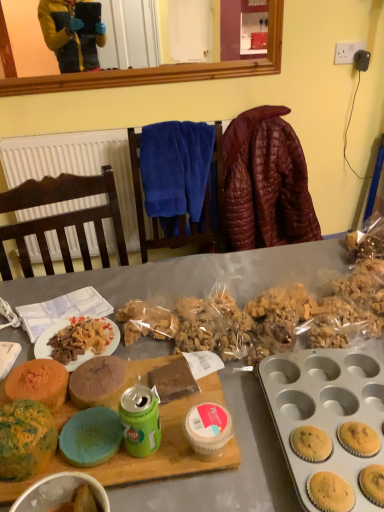
What do you see at coordinates (196, 275) in the screenshot?
I see `matte wooden desk at center` at bounding box center [196, 275].

Measure the distance between matte wooden desk at center and camera.

26.48 inches.

At what (x,y) coordinates should I click in order to perform the action: click on white textured radiator at upper left. Please return your answer as a coordinate pair (x, y). This screenshot has width=384, height=512. Looking at the image, I should click on (76, 165).

Measure the distance between white textured radiator at upper left and camera.

The depth of white textured radiator at upper left is 5.26 feet.

What do you see at coordinates (140, 420) in the screenshot? I see `green metallic can at center` at bounding box center [140, 420].

What are the coordinates of `matte wooden desk at center` in the screenshot? It's located at (196, 275).

Locate an element on the screen. desk below the blue soft towel at center (from the image's perspective) is located at coordinates (196, 275).

Based on the photo, considering the sizes of matte wooden desk at center and blue soft towel at center in the image, is matte wooden desk at center taller or shorter than blue soft towel at center?

In the image, matte wooden desk at center appears to be taller than blue soft towel at center.

Considering the relative sizes of blue soft towel at center and multicolored sponge cake at center left, which is counted as the second snack, starting from the front, in the image provided, is blue soft towel at center smaller than multicolored sponge cake at center left, which is counted as the second snack, starting from the front,?

No, blue soft towel at center is not smaller than multicolored sponge cake at center left, which is counted as the second snack, starting from the front.

Considering the relative positions of blue soft towel at center and multicolored sponge cake at center left, which is counted as the second snack, starting from the front, in the image provided, is blue soft towel at center to the right of multicolored sponge cake at center left, which is counted as the second snack, starting from the front, from the viewer's perspective?

Yes, blue soft towel at center is to the right of multicolored sponge cake at center left, which is counted as the second snack, starting from the front.

Are blue soft towel at center and multicolored sponge cake at center left, the 1th snack when ordered from back to front, located far from each other?

blue soft towel at center is positioned a significant distance from multicolored sponge cake at center left, the 1th snack when ordered from back to front.

Is blue soft towel at center spatially inside multicolored sponge cake at center left, which is counted as the second snack, starting from the front, or outside of it?

blue soft towel at center is not inside multicolored sponge cake at center left, which is counted as the second snack, starting from the front, it's outside.

From a real-world perspective, which object rests below the other?

white matte plate at center, from a real-world perspective.

Based on the photo, relative to white matte plate at center, is blue soft towel at center in front or behind?

Clearly, blue soft towel at center is behind white matte plate at center.

Can you tell me how much blue soft towel at center and white matte plate at center differ in facing direction?

The angular difference between blue soft towel at center and white matte plate at center is 4.8 degrees.

Is blue soft towel at center to the left or to the right of white matte plate at center in the image?

Clearly, blue soft towel at center is on the right of white matte plate at center in the image.

Is multicolored sponge cake at center left, which is counted as the second snack, starting from the front, next to speckled green cake at center left, which ranks as the first snack in front-to-back order, and touching it?

Yes, multicolored sponge cake at center left, which is counted as the second snack, starting from the front, is in contact with speckled green cake at center left, which ranks as the first snack in front-to-back order.

Is multicolored sponge cake at center left, which is counted as the second snack, starting from the front, spatially inside speckled green cake at center left, arranged as the second snack when viewed from the back, or outside of it?

multicolored sponge cake at center left, which is counted as the second snack, starting from the front, is outside speckled green cake at center left, arranged as the second snack when viewed from the back.

How many degrees apart are the facing directions of multicolored sponge cake at center left, the 1th snack when ordered from back to front, and speckled green cake at center left, which ranks as the first snack in front-to-back order?

The facing directions of multicolored sponge cake at center left, the 1th snack when ordered from back to front, and speckled green cake at center left, which ranks as the first snack in front-to-back order, are 0 degrees apart.

From a real-world perspective, relative to speckled green cake at center left, arranged as the second snack when viewed from the back, is multicolored sponge cake at center left, the 1th snack when ordered from back to front, vertically above or below?

multicolored sponge cake at center left, the 1th snack when ordered from back to front, is situated lower than speckled green cake at center left, arranged as the second snack when viewed from the back, in the real world.

Which object is further away from the camera taking this photo, speckled green cake at center left, which ranks as the first snack in front-to-back order, or matte wooden desk at center?

speckled green cake at center left, which ranks as the first snack in front-to-back order.

Who is smaller, speckled green cake at center left, arranged as the second snack when viewed from the back, or matte wooden desk at center?

speckled green cake at center left, arranged as the second snack when viewed from the back, is smaller.

From a real-world perspective, who is located lower, speckled green cake at center left, arranged as the second snack when viewed from the back, or matte wooden desk at center?

In real-world perspective, matte wooden desk at center is lower.

Does speckled green cake at center left, arranged as the second snack when viewed from the back, appear on the left side of matte wooden desk at center?

Correct, you'll find speckled green cake at center left, arranged as the second snack when viewed from the back, to the left of matte wooden desk at center.

Considering the sizes of objects matte ceramic bowl at center and white textured radiator at upper left in the image provided, who is taller, matte ceramic bowl at center or white textured radiator at upper left?

Standing taller between the two is white textured radiator at upper left.

Where is `radiator located above the matte ceramic bowl at center (from the image's perspective)`? Image resolution: width=384 pixels, height=512 pixels. radiator located above the matte ceramic bowl at center (from the image's perspective) is located at coordinates (76, 165).

Considering the relative sizes of matte ceramic bowl at center and white textured radiator at upper left in the image provided, is matte ceramic bowl at center thinner than white textured radiator at upper left?

No.

Considering the positions of objects green metallic can at center and matte wooden desk at center in the image provided, who is more to the left, green metallic can at center or matte wooden desk at center?

Positioned to the left is green metallic can at center.

How many degrees apart are the facing directions of green metallic can at center and matte wooden desk at center?

The angular difference between green metallic can at center and matte wooden desk at center is 167 degrees.

Find the location of `desk in front of the green metallic can at center`. desk in front of the green metallic can at center is located at coordinates (196, 275).

Locate an element on the screen. The image size is (384, 512). desk below the blue soft towel at center (from a real-world perspective) is located at coordinates (196, 275).

I want to click on the 1st snack below the blue soft towel at center (from the image's perspective), so click(x=38, y=382).

When comparing their distances from white matte plate at center, does matte ceramic bowl at center or speckled green cake at center left, which ranks as the first snack in front-to-back order, seem further?

matte ceramic bowl at center is positioned further to the anchor white matte plate at center.

From the image, which object appears to be nearer to matte wooden desk at center, white matte plate at center or speckled green cake at center left, arranged as the second snack when viewed from the back?

white matte plate at center.

Based on their spatial positions, is speckled green cake at center left, arranged as the second snack when viewed from the back, or multicolored sponge cake at center left, the 1th snack when ordered from back to front, further from blue soft towel at center?

Based on the image, speckled green cake at center left, arranged as the second snack when viewed from the back, appears to be further to blue soft towel at center.

Based on their spatial positions, is matte ceramic bowl at center or speckled green cake at center left, arranged as the second snack when viewed from the back, closer to blue soft towel at center?

speckled green cake at center left, arranged as the second snack when viewed from the back, is positioned closer to the anchor blue soft towel at center.

Which object lies nearer to the anchor point white matte plate at center, blue soft towel at center or matte ceramic bowl at center?

The object closer to white matte plate at center is matte ceramic bowl at center.

Looking at the image, which one is located closer to matte ceramic bowl at center, matte wooden desk at center or speckled green cake at center left, arranged as the second snack when viewed from the back?

speckled green cake at center left, arranged as the second snack when viewed from the back, lies closer to matte ceramic bowl at center than the other object.

When comparing their distances from matte ceramic bowl at center, does white textured radiator at upper left or speckled green cake at center left, arranged as the second snack when viewed from the back, seem closer?

The object closer to matte ceramic bowl at center is speckled green cake at center left, arranged as the second snack when viewed from the back.

Looking at the image, which one is located further to white textured radiator at upper left, white matte plate at center or green metallic can at center?

Among the two, green metallic can at center is located further to white textured radiator at upper left.

Where is `blanket between matte wooden desk at center and white textured radiator at upper left in the front-back direction`? blanket between matte wooden desk at center and white textured radiator at upper left in the front-back direction is located at coordinates (265, 182).

Locate an element on the screen. The width and height of the screenshot is (384, 512). chair between multicolored sponge cake at center left, the 1th snack when ordered from back to front, and white textured radiator at upper left, along the z-axis is located at coordinates (180, 215).

The height and width of the screenshot is (512, 384). I want to click on plate positioned between green metallic can at center and leather jacket at upper right from near to far, so click(x=84, y=345).

The width and height of the screenshot is (384, 512). What are the coordinates of `chair positioned between matte ceramic bowl at center and white textured radiator at upper left from near to far` in the screenshot? It's located at (180, 215).